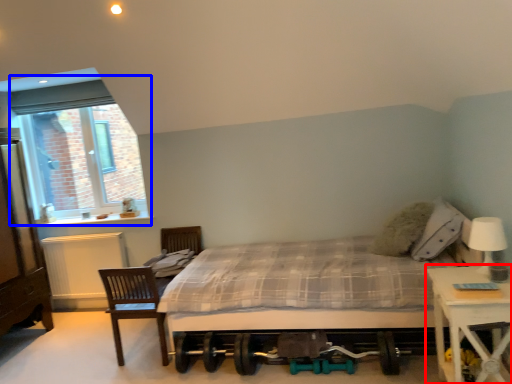
Question: Which object appears closest to the camera in this image, nightstand (highlighted by a red box) or window (highlighted by a blue box)?

Choices:
 (A) nightstand
 (B) window

Answer: (A)